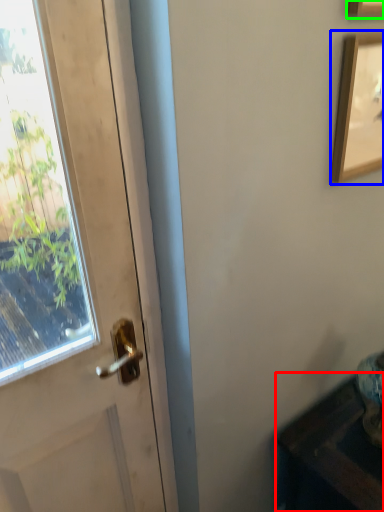
Question: Considering the real-world distances, which object is closest to furniture (highlighted by a red box)? picture frame (highlighted by a blue box) or picture frame (highlighted by a green box).

Choices:
 (A) picture frame
 (B) picture frame

Answer: (A)